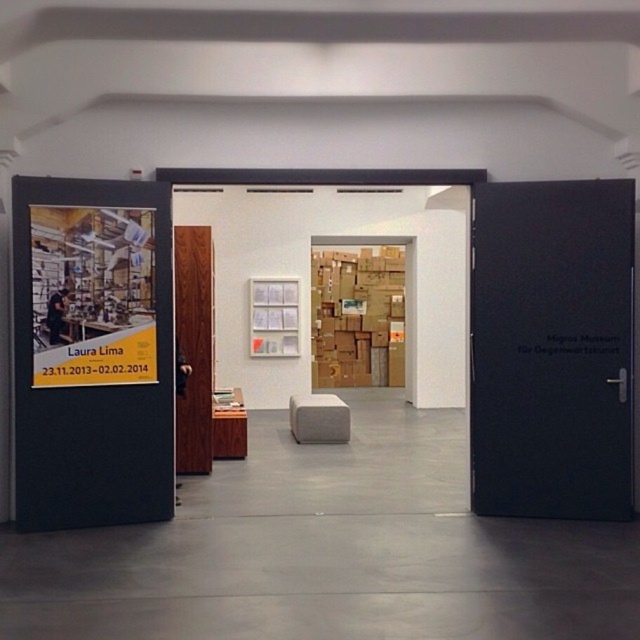
Question: Is black matte door at right smaller than wooden door at center?

Choices:
 (A) no
 (B) yes

Answer: (A)

Question: Can you confirm if black matte door at right is smaller than matte black poster at left?

Choices:
 (A) yes
 (B) no

Answer: (B)

Question: Can you confirm if matte black poster at left is positioned below beige fabric stool at center?

Choices:
 (A) no
 (B) yes

Answer: (A)

Question: Based on their relative distances, which object is nearer to the wooden door at center?

Choices:
 (A) matte black poster at left
 (B) beige fabric stool at center
 (C) black matte door at right

Answer: (A)

Question: Which object is the closest to the wooden door at center?

Choices:
 (A) matte black poster at left
 (B) beige fabric stool at center

Answer: (A)

Question: Which object is positioned closest to the beige fabric stool at center?

Choices:
 (A) wooden door at center
 (B) black matte door at right
 (C) matte black poster at left

Answer: (A)